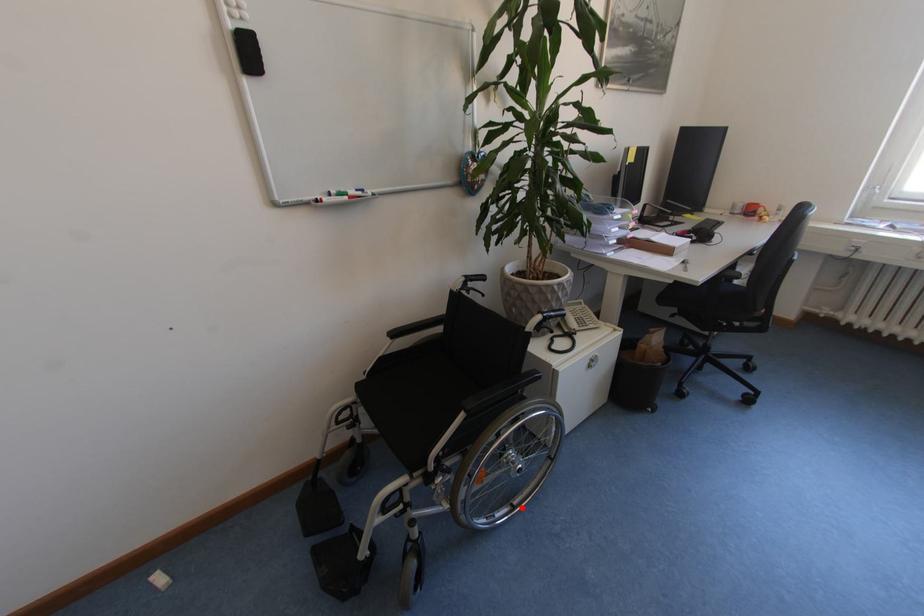
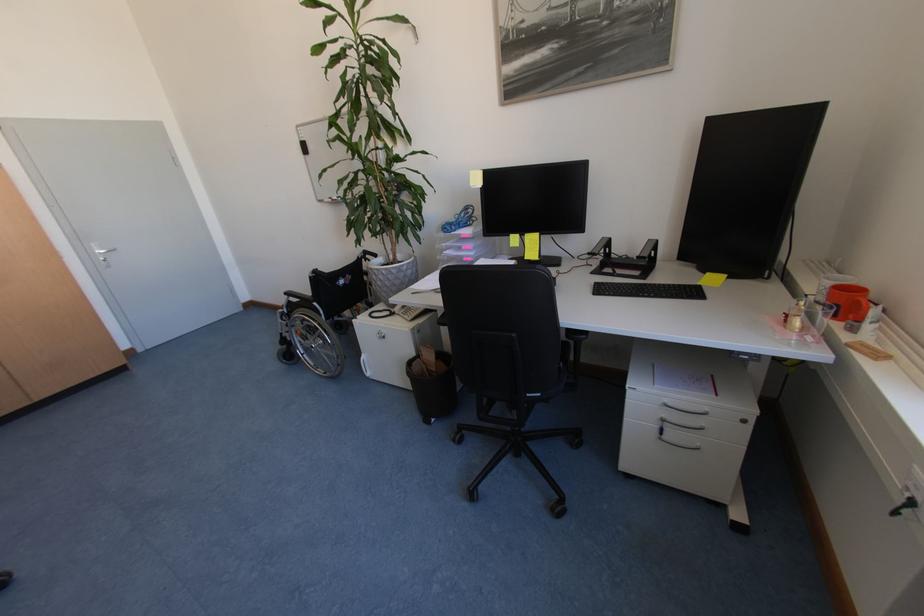
In the second image, find the point that corresponds to the highlighted location in the first image.

(333, 374)